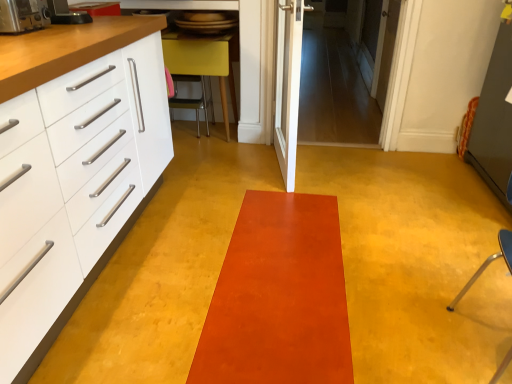
Locate an element on the screen. The image size is (512, 384). vacant area situated to the left side of blue plastic chair at right, arranged as the first furniture when viewed from the front is located at coordinates click(x=391, y=337).